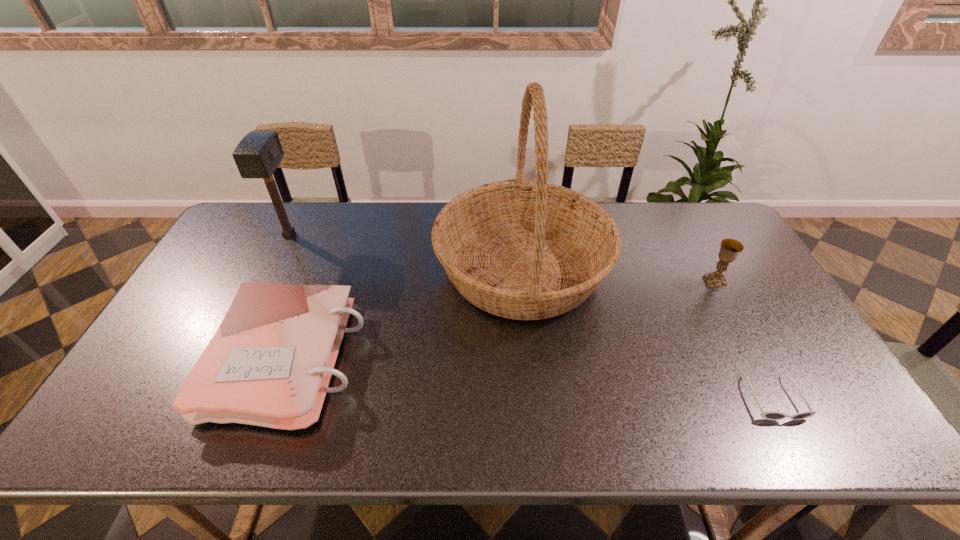
The width and height of the screenshot is (960, 540). I want to click on basket that is at the far edge, so click(x=520, y=249).

Identify the location of mallet that is at the far edge. (258, 154).

The width and height of the screenshot is (960, 540). I want to click on phonebook situated at the near edge, so click(269, 364).

Image resolution: width=960 pixels, height=540 pixels. What are the coordinates of `sunglasses at the near edge` in the screenshot? It's located at (769, 415).

Locate an element on the screen. The width and height of the screenshot is (960, 540). chalice situated at the right edge is located at coordinates (730, 248).

I want to click on sunglasses at the right edge, so point(769,415).

The width and height of the screenshot is (960, 540). In order to click on object at the near right corner in this screenshot , I will do `click(769, 415)`.

Identify the location of vacant space at the far edge of the desktop. (348, 221).

The image size is (960, 540). Find the location of `vacant region at the near edge`. vacant region at the near edge is located at coordinates (698, 429).

Image resolution: width=960 pixels, height=540 pixels. I want to click on free location at the left edge, so click(x=209, y=321).